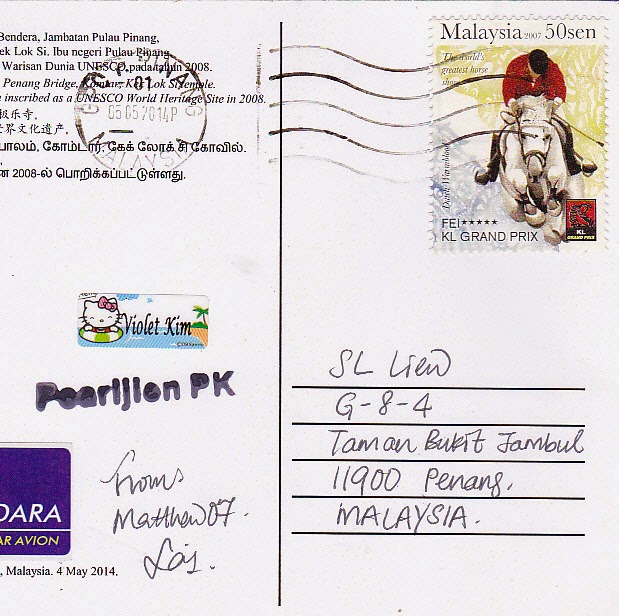
You are a GUI agent. You are given a task and a screenshot of the screen. Output one action in this format:
    pyautogui.click(x=<x>, y=<y>)
    Task: Click on the hello kitty sticker
    
    Given the screenshot: What is the action you would take?
    pyautogui.click(x=92, y=313)